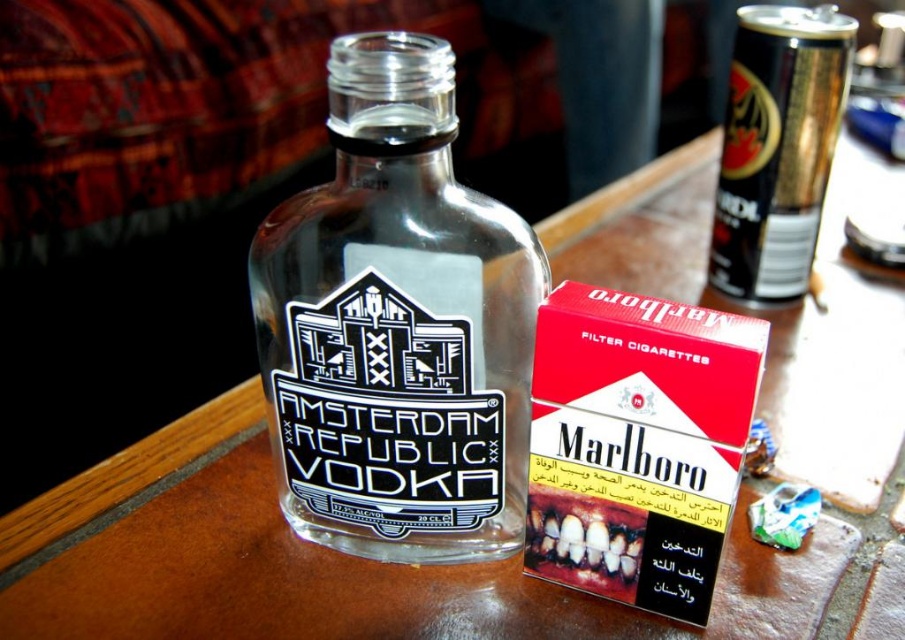
Question: Does transparent glass bottle at center have a smaller size compared to black metallic can at upper right?

Choices:
 (A) yes
 (B) no

Answer: (A)

Question: Among these points, which one is farthest from the camera?

Choices:
 (A) (818, 148)
 (B) (467, 513)

Answer: (A)

Question: Does transparent glass bottle at center appear on the right side of black metallic can at upper right?

Choices:
 (A) no
 (B) yes

Answer: (A)

Question: Which point is farther to the camera?

Choices:
 (A) (345, 45)
 (B) (773, 275)

Answer: (B)

Question: Which point appears farthest from the camera in this image?

Choices:
 (A) (734, 58)
 (B) (335, 250)

Answer: (A)

Question: Does transparent glass bottle at center have a smaller size compared to black metallic can at upper right?

Choices:
 (A) no
 (B) yes

Answer: (B)